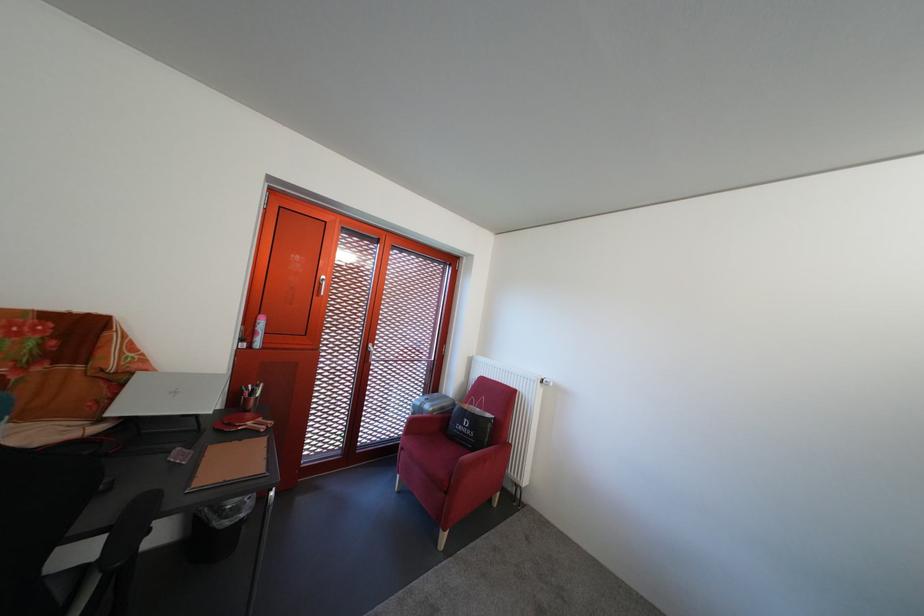
Locate an element on the screen. red chair armrest is located at coordinates (480, 472).